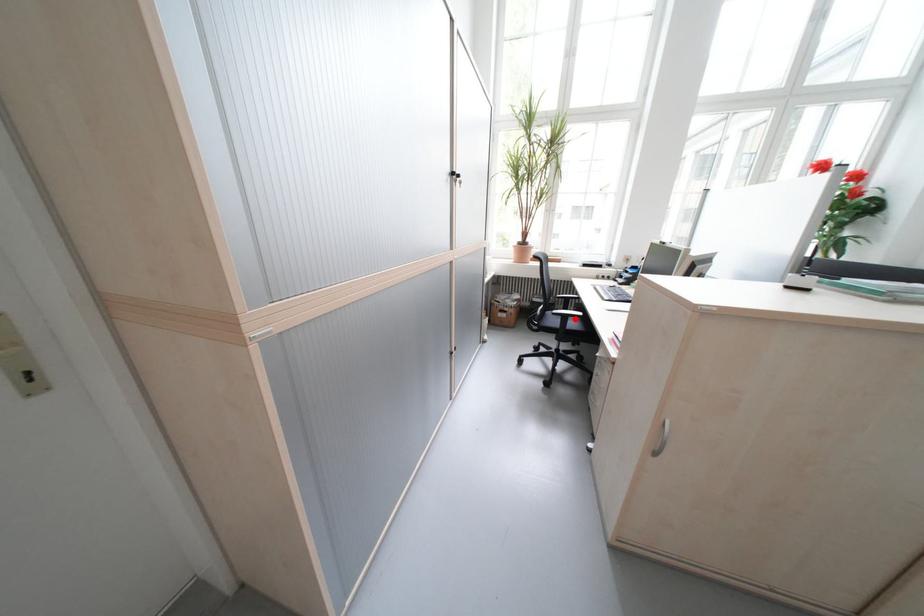
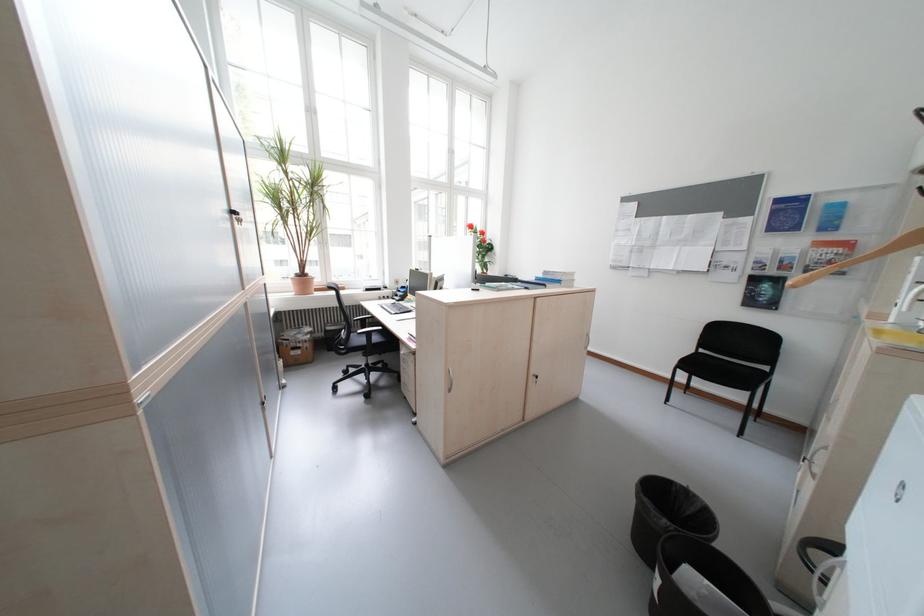
Question: I am providing you with two images of the same scene from different viewpoints. Given a red point in image1, look at the same physical point in image2. Is it:

Choices:
 (A) Closer to the viewpoint
 (B) Farther from the viewpoint

Answer: (B)